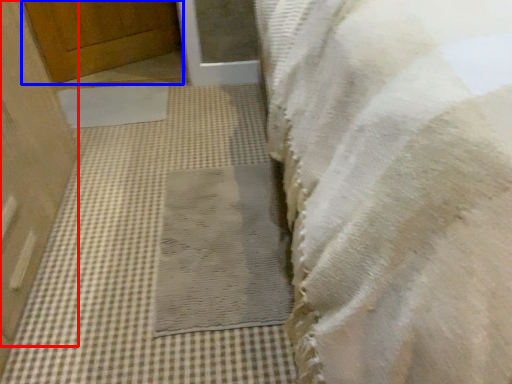
Question: Which of the following is the closest to the observer, door (highlighted by a red box) or door (highlighted by a blue box)?

Choices:
 (A) door
 (B) door

Answer: (A)